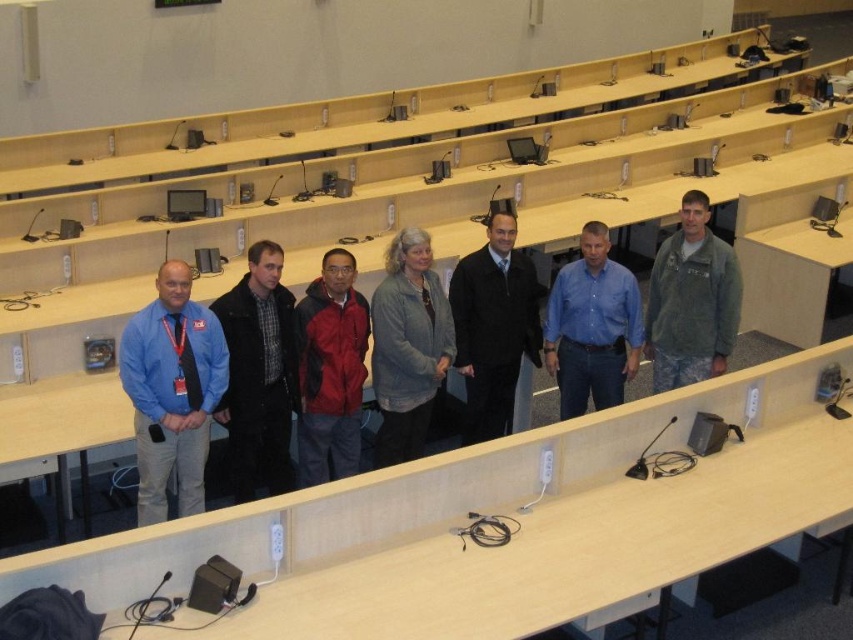
Question: Which of these objects is positioned closest to the gray fleece jacket at center?

Choices:
 (A) plaid fabric shirt at center
 (B) blue denim shirt at center

Answer: (A)

Question: Is matte blue shirt at left above gray fleece jacket at center?

Choices:
 (A) yes
 (B) no

Answer: (B)

Question: Which of the following is the farthest from the observer?

Choices:
 (A) red matte jacket at center
 (B) blue denim shirt at center
 (C) matte blue shirt at left

Answer: (B)

Question: Is gray fleece jacket at center below camouflage jacket at center?

Choices:
 (A) no
 (B) yes

Answer: (B)

Question: Which object is closer to the camera taking this photo?

Choices:
 (A) blue denim shirt at center
 (B) camouflage jacket at center

Answer: (A)

Question: Is black matte jacket at center positioned in front of blue denim shirt at center?

Choices:
 (A) no
 (B) yes

Answer: (A)